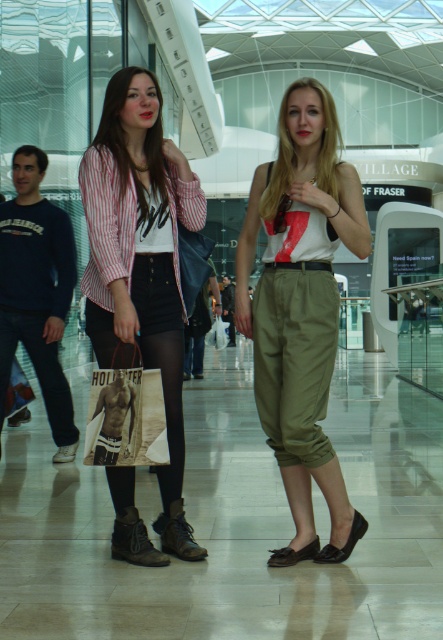
You are a fashion designer observing two items in the image. The khaki cotton pants at center and the striped cotton shirt at center. Which one has a larger size?

The khaki cotton pants at center is bigger than striped cotton shirt at center.

You are a fashion designer observing two clothing items in the scene. The khaki cotton pants at center and the striped cotton shirt at center. Which clothing item is located below the other?

The khaki cotton pants at center is positioned under striped cotton shirt at center.